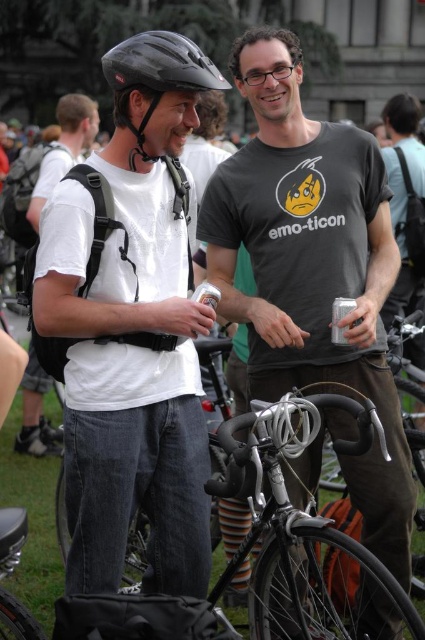
Question: Is white matte t-shirt at left positioned at the back of black matte bicycle helmet at upper left?

Choices:
 (A) yes
 (B) no

Answer: (A)

Question: Is dark gray t-shirt with graphic at center in front of white matte t-shirt at left?

Choices:
 (A) yes
 (B) no

Answer: (A)

Question: Which point is closer to the camera?

Choices:
 (A) (348, 432)
 (B) (79, 115)

Answer: (A)

Question: Which point is farther to the camera?

Choices:
 (A) black matte bicycle helmet at upper left
 (B) dark gray t-shirt with graphic at center
 (C) transparent plastic goggles at upper center
 (D) white matte t-shirt at left

Answer: (D)

Question: Is black matte bicycle helmet at upper left behind transparent plastic goggles at upper center?

Choices:
 (A) yes
 (B) no

Answer: (B)

Question: Among these objects, which one is farthest from the camera?

Choices:
 (A) dark gray t-shirt with graphic at center
 (B) white matte t-shirt at left

Answer: (B)